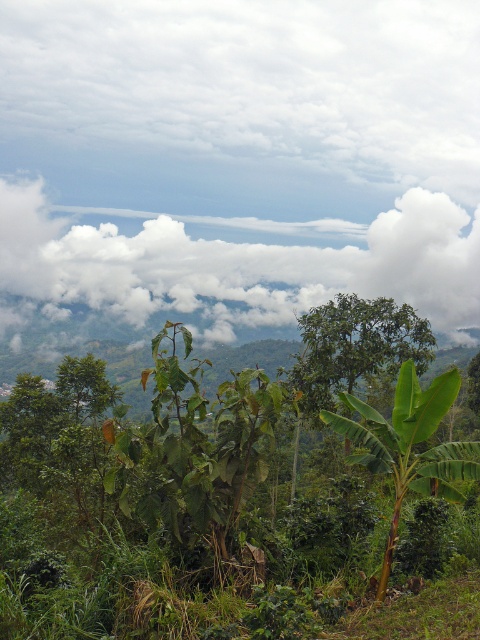
Question: Does white fluffy cloud at upper center appear under green leafy plant at center?

Choices:
 (A) yes
 (B) no

Answer: (B)

Question: Among these points, which one is nearest to the camera?

Choices:
 (A) (412, 248)
 (B) (414, 371)

Answer: (B)

Question: Observing the image, what is the correct spatial positioning of white fluffy cloud at upper center in reference to green leafy plant at center?

Choices:
 (A) right
 (B) left

Answer: (B)

Question: Among these points, which one is nearest to the camera?

Choices:
 (A) (371, 467)
 (B) (241, 266)

Answer: (A)

Question: Is white fluffy cloud at upper center positioned at the back of green leafy plant at center?

Choices:
 (A) no
 (B) yes

Answer: (B)